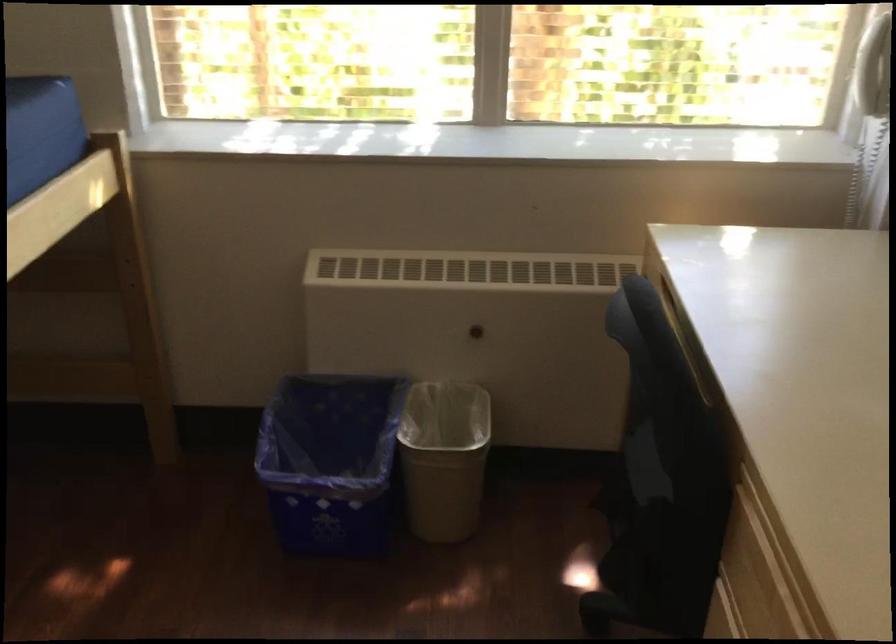
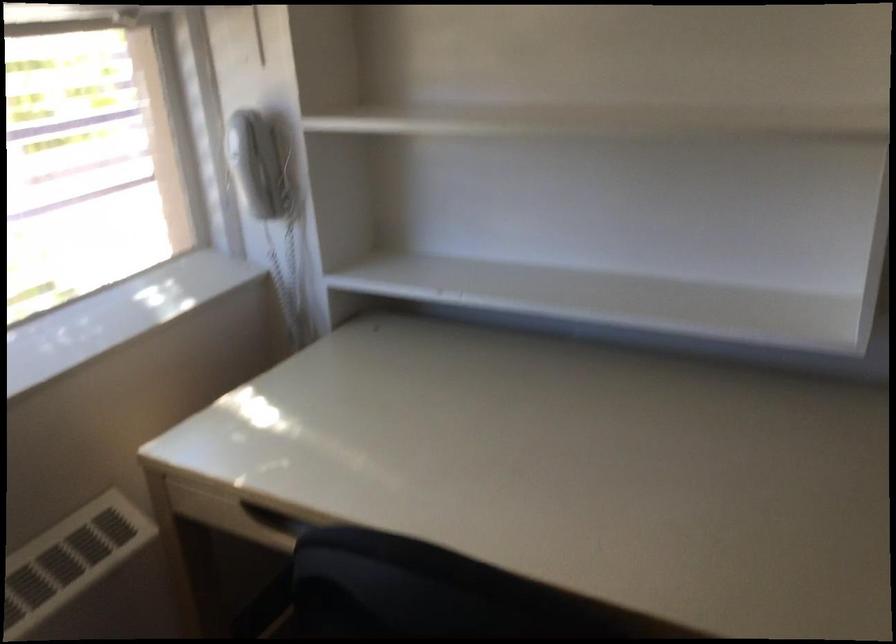
Locate, in the second image, the point that corresponds to (x=656, y=281) in the first image.

(239, 516)